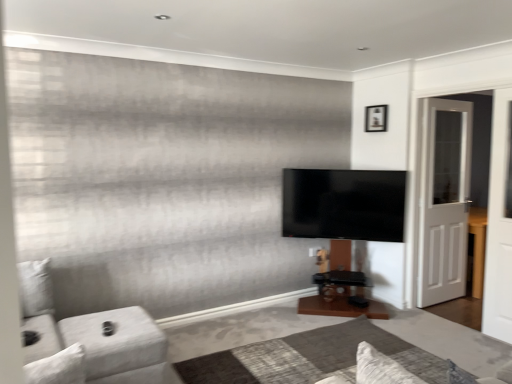
Question: Would you consider matte black tv at center to be distant from white fabric couch at lower left?

Choices:
 (A) yes
 (B) no

Answer: (A)

Question: Is matte black tv at center thinner than white fabric couch at lower left?

Choices:
 (A) no
 (B) yes

Answer: (B)

Question: Is matte black tv at center wider than white fabric couch at lower left?

Choices:
 (A) no
 (B) yes

Answer: (A)

Question: Can you confirm if matte black tv at center is positioned to the right of white fabric couch at lower left?

Choices:
 (A) no
 (B) yes

Answer: (B)

Question: Can you confirm if matte black tv at center is bigger than white fabric couch at lower left?

Choices:
 (A) yes
 (B) no

Answer: (B)

Question: Looking at the image, does white fabric couch at lower left seem bigger or smaller compared to matte black tv at center?

Choices:
 (A) big
 (B) small

Answer: (A)

Question: Looking at their shapes, would you say white fabric couch at lower left is wider or thinner than matte black tv at center?

Choices:
 (A) thin
 (B) wide

Answer: (B)

Question: Considering their positions, is white fabric couch at lower left located in front of or behind matte black tv at center?

Choices:
 (A) front
 (B) behind

Answer: (A)

Question: In terms of height, does white fabric couch at lower left look taller or shorter compared to matte black tv at center?

Choices:
 (A) tall
 (B) short

Answer: (A)

Question: Is point (152, 342) closer or farther from the camera than point (424, 178)?

Choices:
 (A) farther
 (B) closer

Answer: (B)

Question: Looking at their shapes, would you say white fabric couch at lower left is wider or thinner than white wooden door at right?

Choices:
 (A) wide
 (B) thin

Answer: (A)

Question: Is white fabric couch at lower left bigger or smaller than white wooden door at right?

Choices:
 (A) small
 (B) big

Answer: (B)

Question: Would you say white fabric couch at lower left is inside or outside white wooden door at right?

Choices:
 (A) outside
 (B) inside

Answer: (A)

Question: Is white wooden door at right to the left or to the right of white wooden screen door at right in the image?

Choices:
 (A) right
 (B) left

Answer: (B)

Question: From the image's perspective, is white wooden door at right positioned above or below white wooden screen door at right?

Choices:
 (A) above
 (B) below

Answer: (A)